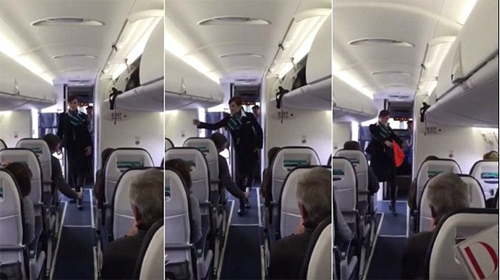
Identify the location of light bulbs. The height and width of the screenshot is (280, 500). (236, 20), (70, 19), (377, 41), (393, 69), (246, 55), (74, 55).